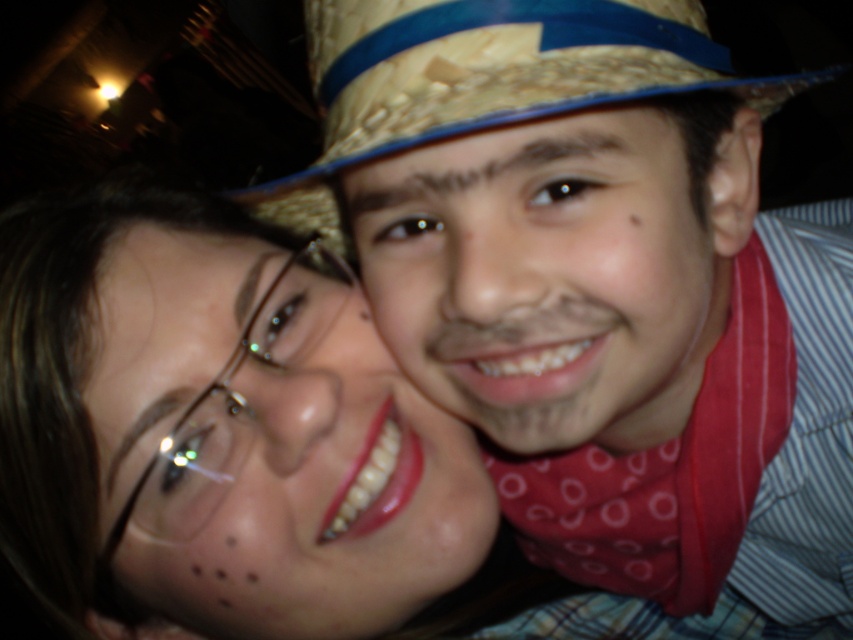
Who is shorter, matte glass face at center or strawmaterial/texturecowboy hat at upper center?

Standing shorter between the two is strawmaterial/texturecowboy hat at upper center.

I want to click on matte glass face at center, so click(x=276, y=449).

How distant is matte red bandana at center from strawmaterial/texturecowboy hat at upper center?

matte red bandana at center and strawmaterial/texturecowboy hat at upper center are 2.72 inches apart.

Is the position of matte red bandana at center less distant than that of strawmaterial/texturecowboy hat at upper center?

No, matte red bandana at center is behind strawmaterial/texturecowboy hat at upper center.

Does point (370, 269) lie in front of point (479, 3)?

That is False.

The width and height of the screenshot is (853, 640). What are the coordinates of `matte red bandana at center` in the screenshot? It's located at (550, 275).

Is straw hat at upper center thinner than matte glass face at center?

Incorrect, straw hat at upper center's width is not less than matte glass face at center's.

Does point (663, 568) come closer to viewer compared to point (292, 360)?

No, it is not.

You are a GUI agent. You are given a task and a screenshot of the screen. Output one action in this format:
    pyautogui.click(x=<x>, y=<y>)
    Task: Click on the straw hat at upper center
    Image resolution: width=853 pixels, height=640 pixels.
    Given the screenshot: What is the action you would take?
    pyautogui.click(x=598, y=284)